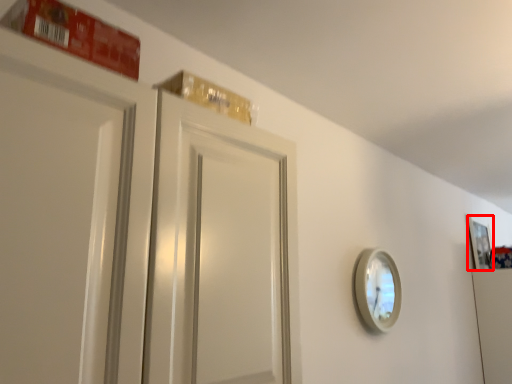
Question: From the image's perspective, what is the correct spatial positioning of picture frame (annotated by the red box) in reference to mirror?

Choices:
 (A) above
 (B) below

Answer: (A)